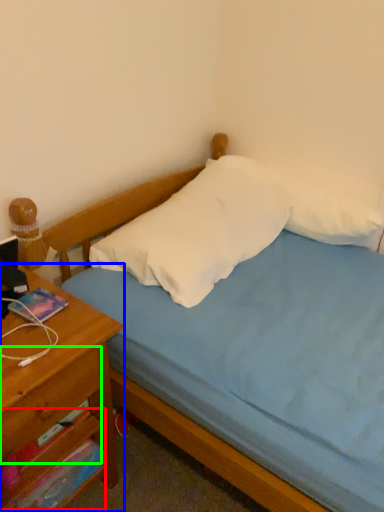
Question: Which object is the closest to the drawer (highlighted by a red box)? Choose among these: nightstand (highlighted by a blue box) or drawer (highlighted by a green box).

Choices:
 (A) nightstand
 (B) drawer

Answer: (A)